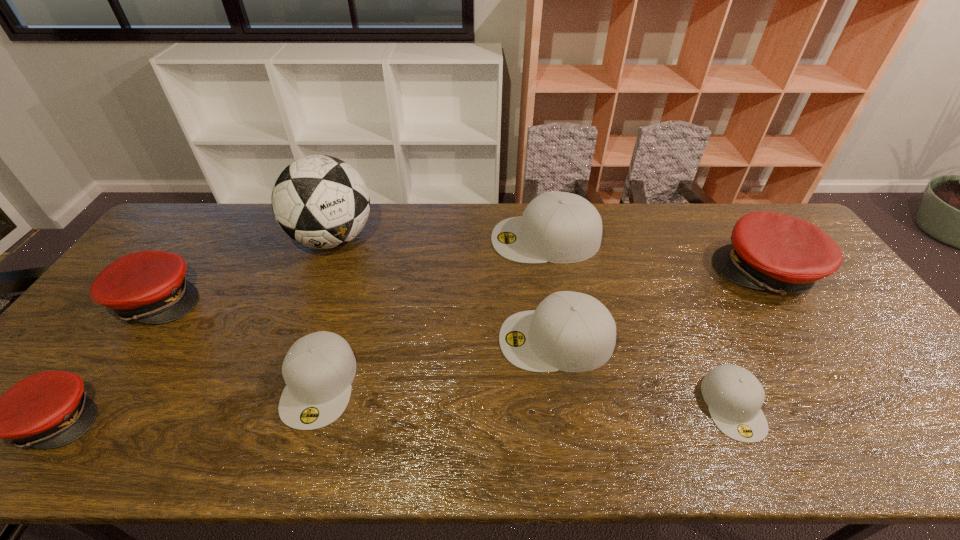
This screenshot has width=960, height=540. What are the coordinates of `the sixth cap from left to right` in the screenshot? It's located at (734, 396).

The width and height of the screenshot is (960, 540). I want to click on vacant space located on the surface of the soccer ball where the brand logo is visible, so click(296, 338).

Where is `vacant area situated on the front-facing side of the farthest gray cap`? This screenshot has width=960, height=540. vacant area situated on the front-facing side of the farthest gray cap is located at coordinates (407, 239).

This screenshot has width=960, height=540. Find the location of `free spot located 0.140m on the front-facing side of the farthest gray cap`. free spot located 0.140m on the front-facing side of the farthest gray cap is located at coordinates (449, 239).

In order to click on vacant space located 0.160m on the front-facing side of the farthest gray cap in this screenshot , I will do `click(443, 239)`.

Locate an element on the screen. free space located 0.390m on the front of the rightmost cap with an emblem is located at coordinates (588, 273).

Where is `vacant space located 0.210m on the front of the rightmost cap with an emblem`? Image resolution: width=960 pixels, height=540 pixels. vacant space located 0.210m on the front of the rightmost cap with an emblem is located at coordinates (648, 273).

This screenshot has width=960, height=540. I want to click on free space located 0.270m on the front of the rightmost cap with an emblem, so click(628, 273).

This screenshot has height=540, width=960. I want to click on free space located 0.180m on the front-facing side of the second biggest gray cap, so click(431, 340).

The height and width of the screenshot is (540, 960). I want to click on vacant area located on the front-facing side of the second biggest gray cap, so click(404, 340).